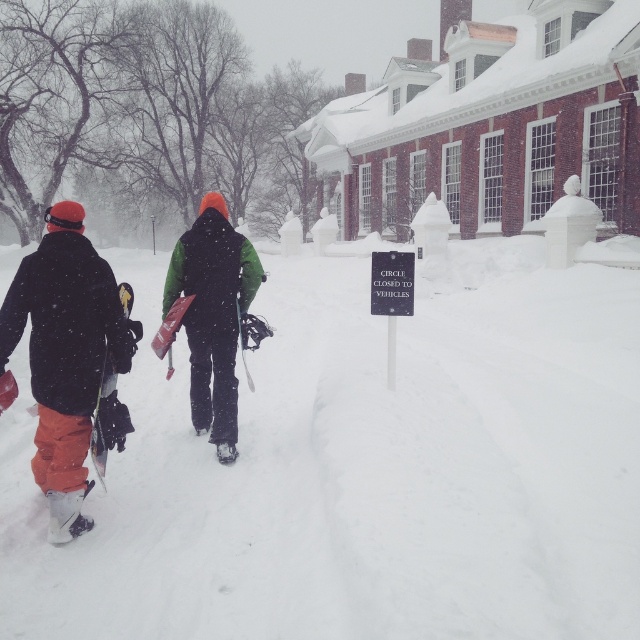
Which of these two, matte black snowboard at left or white matte snowshoe at lower left, stands shorter?

white matte snowshoe at lower left

Between point (44, 404) and point (74, 493), which one is positioned in front?

Point (44, 404)

Which is behind, point (4, 403) or point (90, 524)?

Point (90, 524)

This screenshot has width=640, height=640. Identify the location of matte black snowboard at left. (65, 355).

Is matte black snowboard at left to the left of matte black ski at left from the viewer's perspective?

Indeed, matte black snowboard at left is positioned on the left side of matte black ski at left.

Who is positioned more to the right, matte black snowboard at left or matte black ski at left?

Positioned to the right is matte black ski at left.

Between point (115, 356) and point (108, 404), which one is positioned behind?

The point (108, 404) is behind.

The height and width of the screenshot is (640, 640). Find the location of `matte black snowboard at left`. matte black snowboard at left is located at coordinates (65, 355).

The height and width of the screenshot is (640, 640). What do you see at coordinates (362, 467) in the screenshot?
I see `white fluffy snow at center` at bounding box center [362, 467].

Who is more forward, (268,451) or (230,445)?

Positioned in front is point (230,445).

Where is `white fluffy snow at center`? white fluffy snow at center is located at coordinates (362, 467).